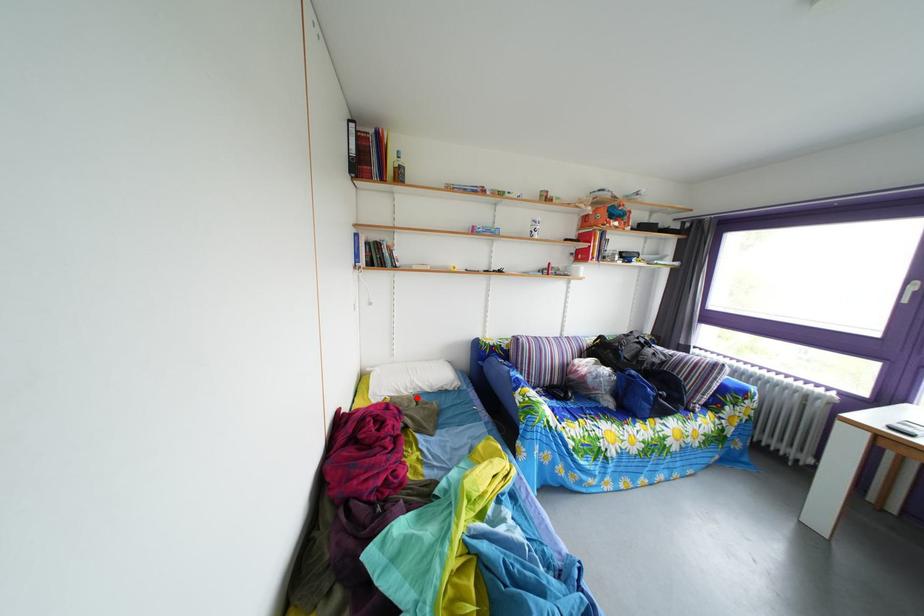
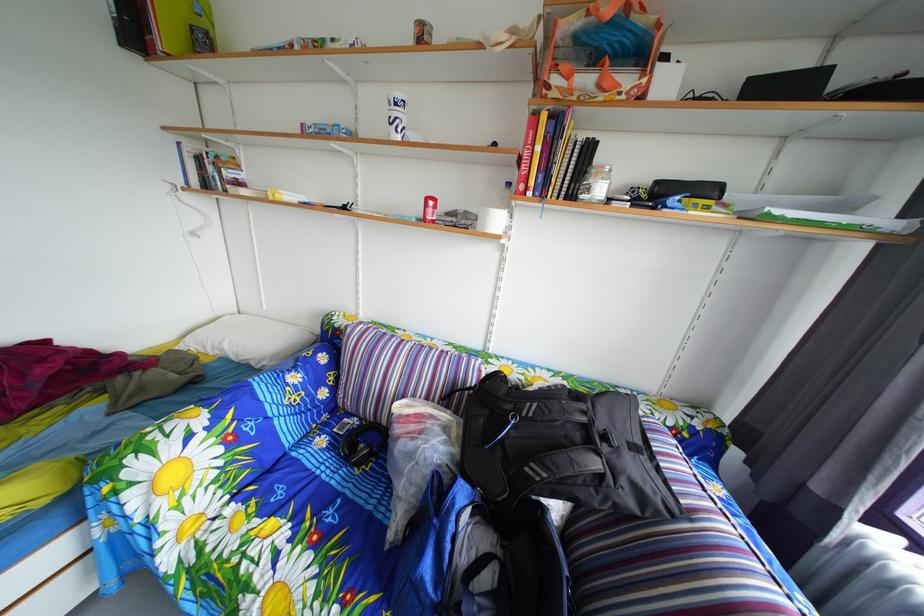
Find the pixel in the second image that matches the highlighted location in the first image.

(224, 357)